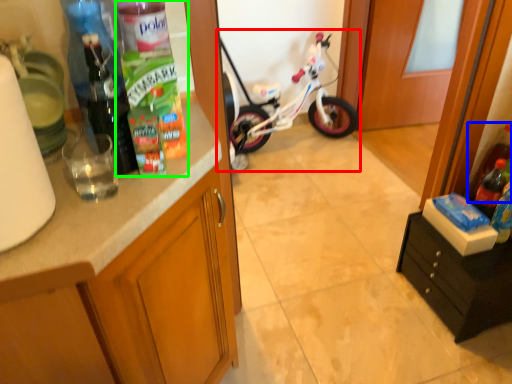
Question: Which is nearer to the bicycle (highlighted by a red box)? bottle (highlighted by a blue box) or bottle (highlighted by a green box).

Choices:
 (A) bottle
 (B) bottle

Answer: (A)